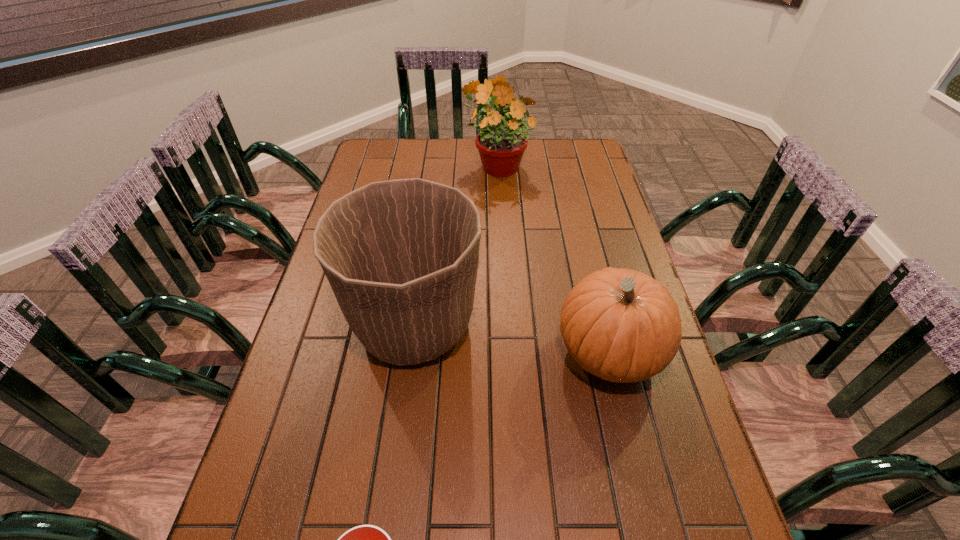
Locate an element on the screen. This screenshot has width=960, height=540. object present at the right edge is located at coordinates (621, 325).

You are a GUI agent. You are given a task and a screenshot of the screen. Output one action in this format:
    pyautogui.click(x=<x>, y=<y>)
    Task: Click on the vacant region at the far edge of the desktop
    This screenshot has height=540, width=960.
    Given the screenshot: What is the action you would take?
    pyautogui.click(x=441, y=161)

Find the location of a particular element. This screenshot has width=960, height=540. vacant space at the left edge of the desktop is located at coordinates (259, 481).

Locate an element on the screen. This screenshot has width=960, height=540. free space at the right edge is located at coordinates (641, 433).

In the image, there is a desktop. Identify the location of vacant space at the far left corner. (390, 139).

The width and height of the screenshot is (960, 540). Find the location of `empty space that is in between the third tallest object and the nearer flowerpot`. empty space that is in between the third tallest object and the nearer flowerpot is located at coordinates (512, 338).

Where is `unoccupied area between the nearer flowerpot and the pumpkin`? Image resolution: width=960 pixels, height=540 pixels. unoccupied area between the nearer flowerpot and the pumpkin is located at coordinates (x=512, y=338).

What are the coordinates of `empty space between the pumpkin and the nearer flowerpot` in the screenshot? It's located at (512, 338).

What are the coordinates of `blank region between the nearer flowerpot and the pumpkin` in the screenshot? It's located at (512, 338).

Locate an element on the screen. The image size is (960, 540). object that stands as the closest to the farther flowerpot is located at coordinates (401, 256).